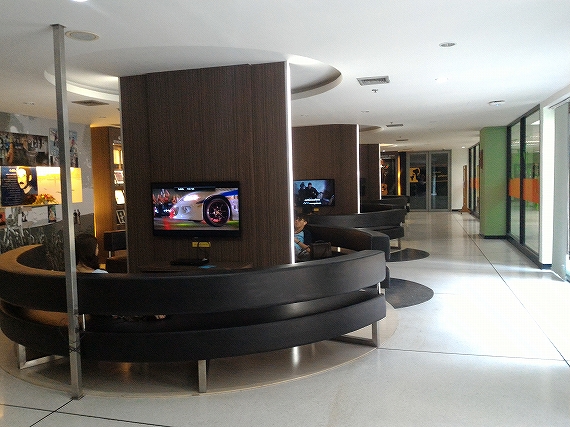
The image size is (570, 427). Find the location of `concrete floor`. concrete floor is located at coordinates (520, 300), (478, 398), (321, 403), (446, 271), (441, 230), (164, 411).